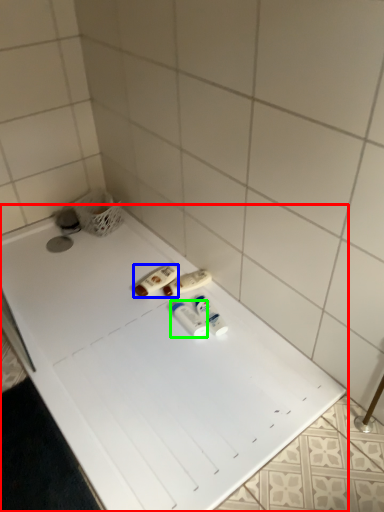
Question: Which object is the farthest from bathtub (highlighted by a red box)? Choose among these: toiletry (highlighted by a blue box) or toiletry (highlighted by a green box).

Choices:
 (A) toiletry
 (B) toiletry

Answer: (A)